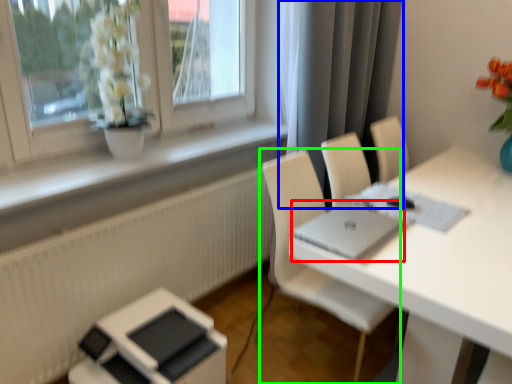
Question: Based on their relative distances, which object is farther from laptop (highlighted by a red box)? Choose from curtain (highlighted by a blue box) and chair (highlighted by a green box).

Choices:
 (A) curtain
 (B) chair

Answer: (A)